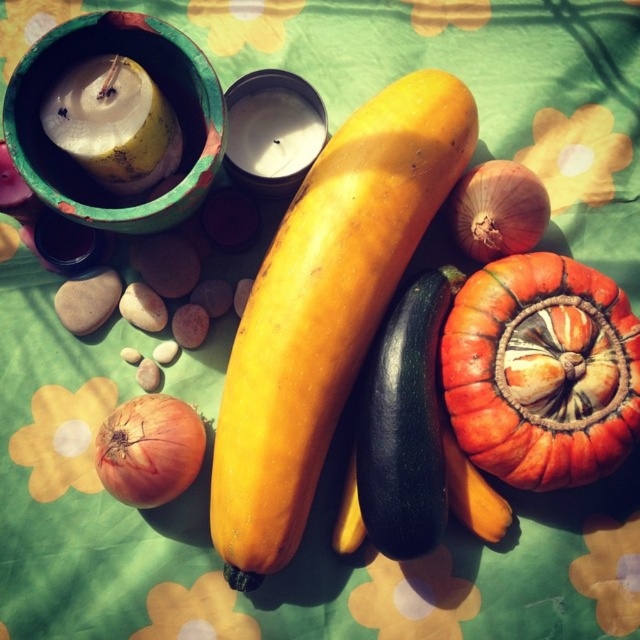
What is the position of the point at coordinates (541,371) in relation to the orange matte pumpkin at center?

The point at coordinates (541,371) is located on the orange matte pumpkin at center.

You are standing 1.5 meters away from the camera. Is the point at coordinates point (452, 156) closer to you than the camera?

The distance between point (452, 156) and the camera is 1.16 meters. Since you are standing 1.5 meters away from the camera, the point is closer to you than the camera.

You are arranging a birthday cake on the table and need to place it where there is space. Looking at the image, where would you place the cake so it is not blocked by the yellow matte squash at center or the yellow wax candle at upper left?

The yellow wax candle at upper left is behind the yellow matte squash at center, so placing the cake in front of the yellow matte squash at center would ensure it is visible and not blocked by either object.